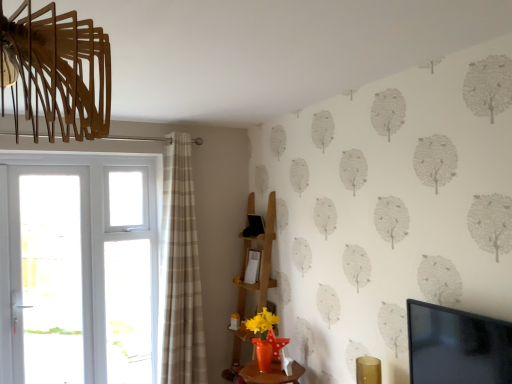
Question: From the image's perspective, does beige plaid curtain at left appear lower than white glass screen door at left?

Choices:
 (A) no
 (B) yes

Answer: (A)

Question: Is white glass screen door at left a part of beige plaid curtain at left?

Choices:
 (A) no
 (B) yes

Answer: (A)

Question: Is beige plaid curtain at left looking in the opposite direction of white glass screen door at left?

Choices:
 (A) yes
 (B) no

Answer: (B)

Question: Considering the relative sizes of beige plaid curtain at left and white glass screen door at left in the image provided, is beige plaid curtain at left smaller than white glass screen door at left?

Choices:
 (A) yes
 (B) no

Answer: (B)

Question: Is beige plaid curtain at left positioned beyond the bounds of white glass screen door at left?

Choices:
 (A) yes
 (B) no

Answer: (A)

Question: Can you confirm if beige plaid curtain at left is taller than white glass screen door at left?

Choices:
 (A) yes
 (B) no

Answer: (A)

Question: Is beige plaid curtain at left behind wooden shelf at center?

Choices:
 (A) no
 (B) yes

Answer: (A)

Question: Is beige plaid curtain at left shorter than wooden shelf at center?

Choices:
 (A) yes
 (B) no

Answer: (B)

Question: Is wooden shelf at center inside beige plaid curtain at left?

Choices:
 (A) yes
 (B) no

Answer: (B)

Question: Can you confirm if beige plaid curtain at left is smaller than wooden shelf at center?

Choices:
 (A) yes
 (B) no

Answer: (A)

Question: Are beige plaid curtain at left and wooden shelf at center beside each other?

Choices:
 (A) no
 (B) yes

Answer: (A)

Question: From the image's perspective, is beige plaid curtain at left over wooden shelf at center?

Choices:
 (A) no
 (B) yes

Answer: (B)

Question: Is beige plaid curtain at left completely or partially inside wooden shelf at center?

Choices:
 (A) no
 (B) yes

Answer: (A)